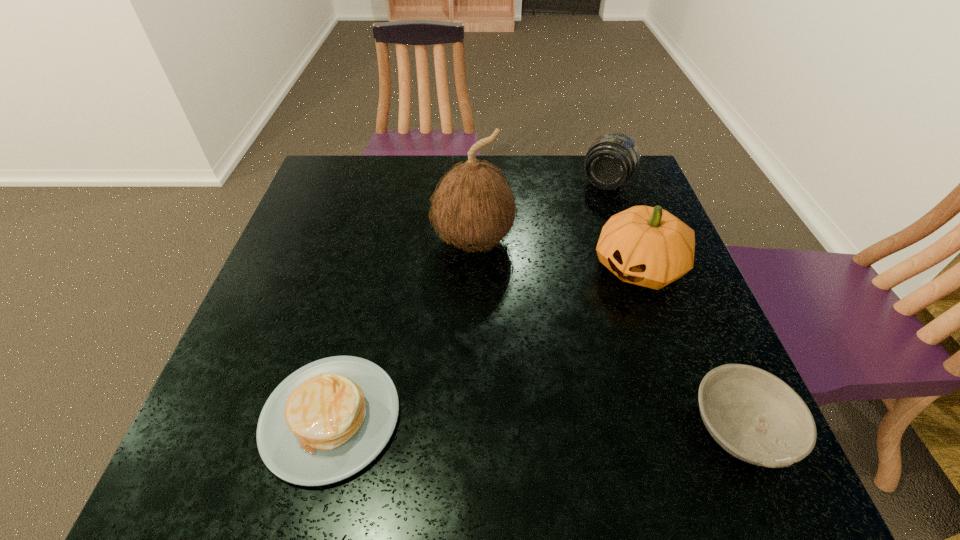
Identify the location of vacant point located between the farthest object and the tallest object. (540, 212).

Locate an element on the screen. vacant area that lies between the farthest object and the pancake is located at coordinates (468, 300).

Select which object is the second closest to the gourd. Please provide its 2D coordinates. Your answer should be formatted as a tuple, i.e. [(x, y)], where the tuple contains the x and y coordinates of a point satisfying the conditions above.

[(473, 207)]

Identify which object is located as the fourth nearest to the bowl. Please provide its 2D coordinates. Your answer should be formatted as a tuple, i.e. [(x, y)], where the tuple contains the x and y coordinates of a point satisfying the conditions above.

[(612, 159)]